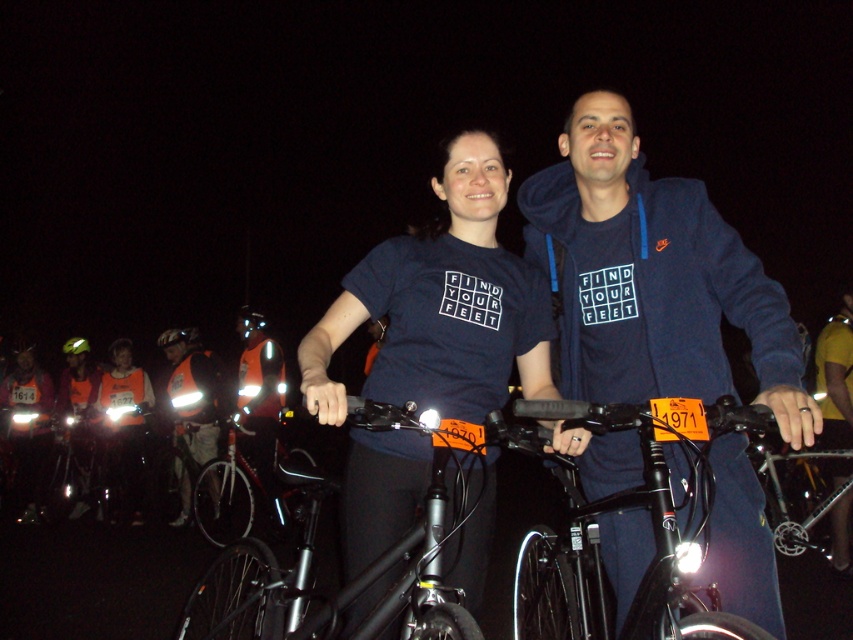
Which is behind, point (442, 248) or point (656, 481)?

Point (442, 248)

Can you confirm if dark blue t-shirt at center is taller than black metallic bicycle at center?

Correct, dark blue t-shirt at center is much taller as black metallic bicycle at center.

The height and width of the screenshot is (640, 853). Find the location of `dark blue t-shirt at center`. dark blue t-shirt at center is located at coordinates (442, 305).

Does yellow fabric shirt at right appear under reflective orange vest at left?

Actually, yellow fabric shirt at right is above reflective orange vest at left.

Can you confirm if yellow fabric shirt at right is bigger than reflective orange vest at left?

No, yellow fabric shirt at right is not bigger than reflective orange vest at left.

Describe the element at coordinates (834, 376) in the screenshot. This screenshot has width=853, height=640. I see `yellow fabric shirt at right` at that location.

Find the location of a particular element. Image resolution: width=853 pixels, height=640 pixels. yellow fabric shirt at right is located at coordinates (834, 376).

Between black metallic bicycle at center and green matte helmet at upper left, which one has more height?

With more height is black metallic bicycle at center.

Does black metallic bicycle at center lie in front of green matte helmet at upper left?

Yes, it is.

Who is more forward, (718, 406) or (67, 346)?

Point (718, 406) is in front.

This screenshot has height=640, width=853. Identify the location of black metallic bicycle at center. (651, 531).